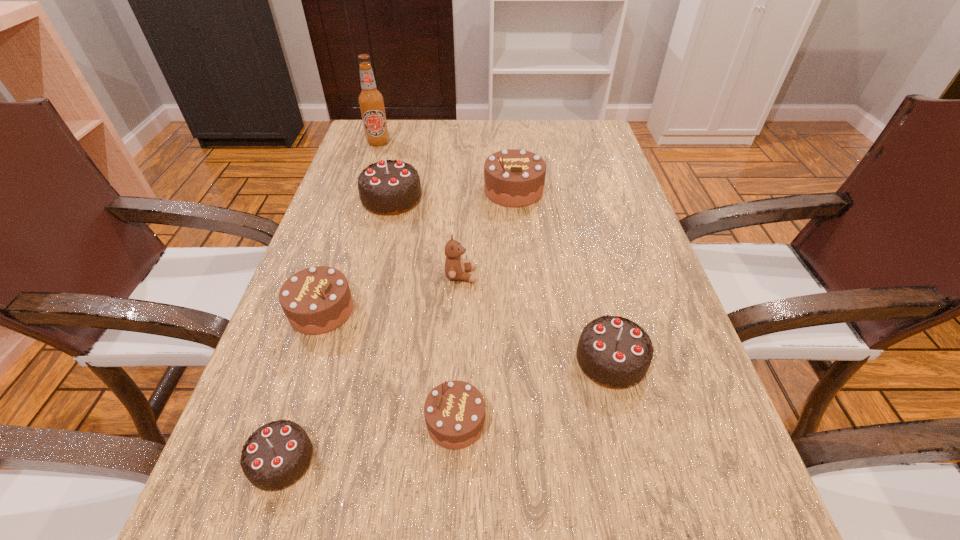
I want to click on free space between the second nearest brown chocolate cake and the nearest chocolate chocolate cake, so click(x=301, y=385).

This screenshot has height=540, width=960. Find the location of `vacant point located between the farthest brown chocolate cake and the second nearest brown chocolate cake`. vacant point located between the farthest brown chocolate cake and the second nearest brown chocolate cake is located at coordinates (418, 251).

In order to click on empty space that is in between the smallest chocolate chocolate cake and the farthest brown chocolate cake in this screenshot , I will do `click(397, 325)`.

You are a GUI agent. You are given a task and a screenshot of the screen. Output one action in this format:
    pyautogui.click(x=<x>, y=<y>)
    Task: Click on the vacant space that's between the second brown chocolate cake from right to left and the brown teddy bear
    The width and height of the screenshot is (960, 540).
    Given the screenshot: What is the action you would take?
    pyautogui.click(x=458, y=349)

Where is `vacant point located between the smallest chocolate chocolate cake and the fifth chocolate cake from left to right`? The height and width of the screenshot is (540, 960). vacant point located between the smallest chocolate chocolate cake and the fifth chocolate cake from left to right is located at coordinates (397, 325).

I want to click on vacant space in between the biggest brown chocolate cake and the biggest chocolate chocolate cake, so click(453, 194).

I want to click on empty space that is in between the tallest object and the second brown chocolate cake from left to right, so click(x=417, y=282).

Where is `empty space between the biggest chocolate chocolate cake and the second farthest brown chocolate cake`? empty space between the biggest chocolate chocolate cake and the second farthest brown chocolate cake is located at coordinates (357, 254).

Choose which object is the second nearest neighbor to the farthest object. Please provide its 2D coordinates. Your answer should be formatted as a tuple, i.e. [(x, y)], where the tuple contains the x and y coordinates of a point satisfying the conditions above.

[(513, 178)]

I want to click on object that stands as the fourth closest to the second brown chocolate cake from left to right, so click(455, 269).